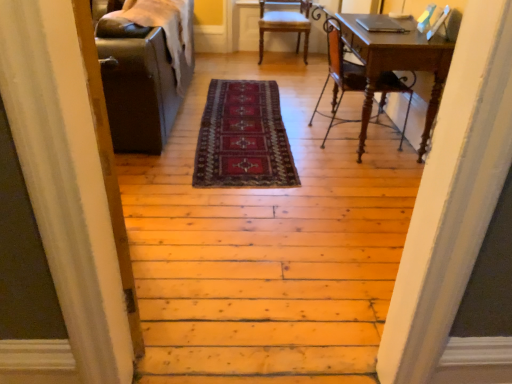
Image resolution: width=512 pixels, height=384 pixels. I want to click on vacant region in front of dark red woven rug at center, so click(x=276, y=215).